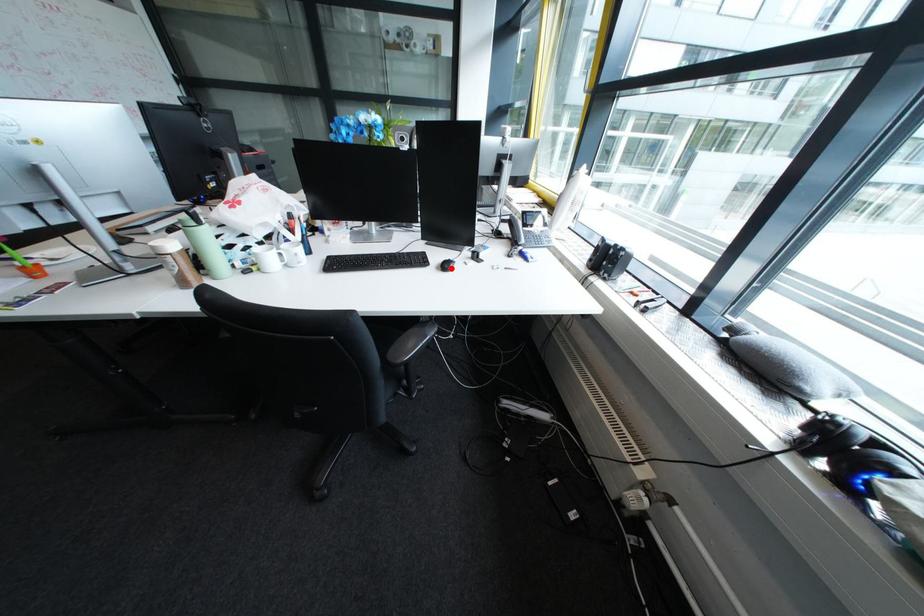
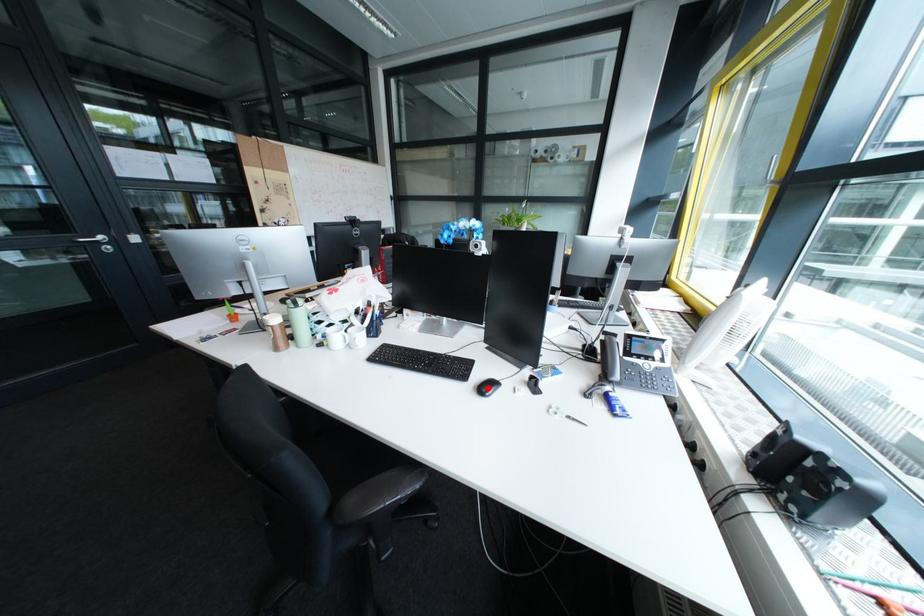
I am providing you with two images of the same scene from different viewpoints. A red point is marked on the first image and another point is marked on the second image. Is the red point in image1 aligned with the point shown in image2?

Yes